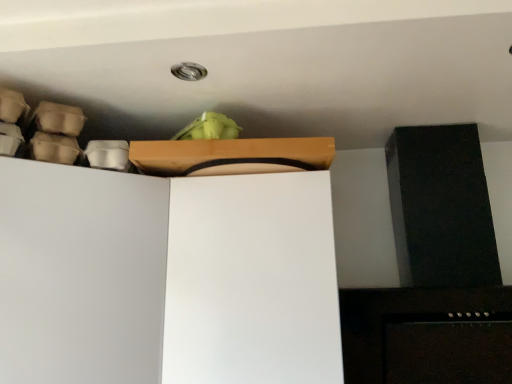
In order to face white matte cabinet at upper left, should I rotate leftwards or rightwards?

To align with it, rotate left about 16.238°.

Describe the element at coordinates (166, 278) in the screenshot. I see `white matte cabinet at upper left` at that location.

The height and width of the screenshot is (384, 512). Find the location of `white matte cabinet at upper left`. white matte cabinet at upper left is located at coordinates (166, 278).

Measure the distance between point [222,153] and camera.

Point [222,153] and camera are 39.13 inches apart from each other.

The height and width of the screenshot is (384, 512). What do you see at coordinates (231, 156) in the screenshot?
I see `wooden box at upper center` at bounding box center [231, 156].

What are the coordinates of `wooden box at upper center` in the screenshot? It's located at (231, 156).

I want to click on white matte cabinet at upper left, so pos(166,278).

Between white matte cabinet at upper left and wooden box at upper center, which one appears on the right side from the viewer's perspective?

Positioned to the right is wooden box at upper center.

Is white matte cabinet at upper left positioned in front of wooden box at upper center?

Yes, white matte cabinet at upper left is closer to the viewer.

Is point (218, 194) farther from viewer compared to point (208, 160)?

Yes, it is.

From the image's perspective, between white matte cabinet at upper left and wooden box at upper center, who is located below?

From the image's view, white matte cabinet at upper left is below.

From a real-world perspective, is white matte cabinet at upper left physically below wooden box at upper center?

Correct, in the physical world, white matte cabinet at upper left is lower than wooden box at upper center.

From the picture: Which object is thinner, white matte cabinet at upper left or wooden box at upper center?

Thinner between the two is wooden box at upper center.

Considering the sizes of white matte cabinet at upper left and wooden box at upper center in the image, is white matte cabinet at upper left taller or shorter than wooden box at upper center?

In the image, white matte cabinet at upper left appears to be taller than wooden box at upper center.

Between white matte cabinet at upper left and wooden box at upper center, which one has smaller size?

With smaller size is wooden box at upper center.

Is white matte cabinet at upper left situated inside wooden box at upper center or outside?

white matte cabinet at upper left is spatially situated outside wooden box at upper center.

Consider the image. Is white matte cabinet at upper left next to wooden box at upper center?

They are not placed beside each other.

Is white matte cabinet at upper left oriented away from wooden box at upper center?

No.

Locate an element on the screen. cabinetry beneath the wooden box at upper center (from a real-world perspective) is located at coordinates point(166,278).

Between wooden box at upper center and white matte cabinet at upper left, which one appears on the right side from the viewer's perspective?

From the viewer's perspective, wooden box at upper center appears more on the right side.

Considering the positions of objects wooden box at upper center and white matte cabinet at upper left in the image provided, who is behind, wooden box at upper center or white matte cabinet at upper left?

wooden box at upper center is further from the camera.

Which is closer to the camera, (x=206, y=145) or (x=260, y=208)?

Point (x=206, y=145)

From the image's perspective, is wooden box at upper center below white matte cabinet at upper left?

No.

Based on the photo, from a real-world perspective, is wooden box at upper center positioned over white matte cabinet at upper left based on gravity?

Yes, from a real-world perspective, wooden box at upper center is above white matte cabinet at upper left.

Which of these two, wooden box at upper center or white matte cabinet at upper left, is wider?

Wider between the two is white matte cabinet at upper left.

Between wooden box at upper center and white matte cabinet at upper left, which one has less height?

wooden box at upper center is shorter.

Is wooden box at upper center smaller than white matte cabinet at upper left?

Yes.

Is white matte cabinet at upper left inside wooden box at upper center?

No, wooden box at upper center does not contain white matte cabinet at upper left.

Is the surface of wooden box at upper center in direct contact with white matte cabinet at upper left?

No, wooden box at upper center is not beside white matte cabinet at upper left.

Is wooden box at upper center oriented towards white matte cabinet at upper left?

No, wooden box at upper center is not oriented towards white matte cabinet at upper left.

The height and width of the screenshot is (384, 512). In the image, there is a wooden box at upper center. In order to click on cabinetry below it (from the image's perspective) in this screenshot , I will do `click(166, 278)`.

Identify the location of cabinetry below the wooden box at upper center (from a real-world perspective). The width and height of the screenshot is (512, 384). (166, 278).

Identify the location of cabinetry on the left side of wooden box at upper center. (166, 278).